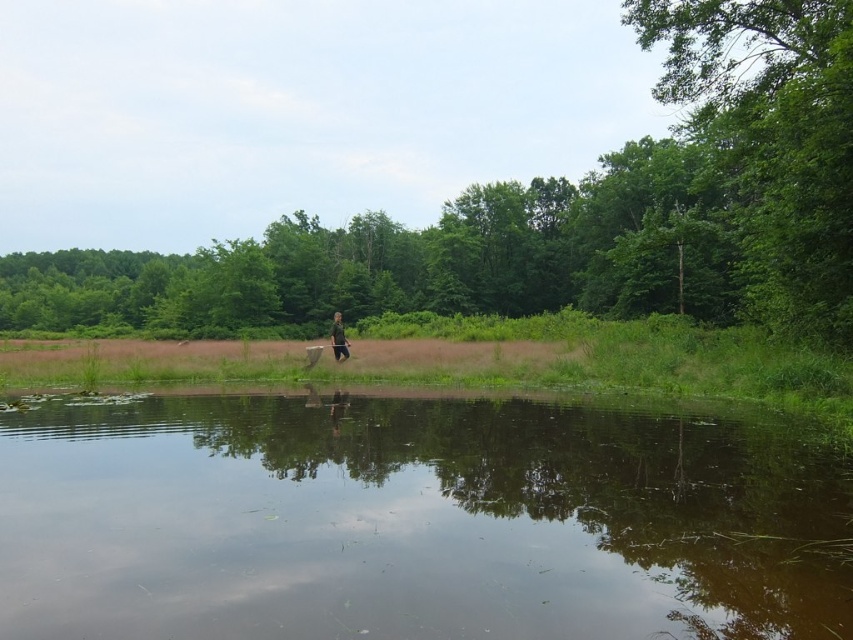
Is green leafy tree at center bigger than green fabric person at center?

Yes.

Between point (848, 40) and point (345, 353), which one is positioned in front?

Positioned in front is point (848, 40).

This screenshot has width=853, height=640. Identify the location of green leafy tree at center. (558, 214).

Can you confirm if brown reflective water at center is positioned to the right of green fabric person at center?

Yes, brown reflective water at center is to the right of green fabric person at center.

Does brown reflective water at center appear on the left side of green fabric person at center?

Incorrect, brown reflective water at center is not on the left side of green fabric person at center.

Where is `brown reflective water at center`? brown reflective water at center is located at coordinates (415, 522).

Does brown reflective water at center have a larger size compared to green leafy tree at center?

No.

Locate an element on the screen. brown reflective water at center is located at coordinates (415, 522).